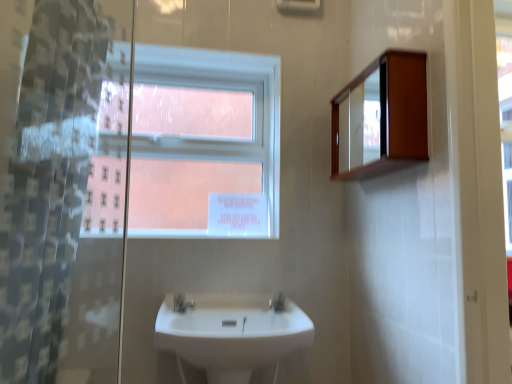
Question: Can you confirm if silver metallic tap at center, the second tap viewed from the right, is positioned to the right of white plastic window at upper center?

Choices:
 (A) no
 (B) yes

Answer: (B)

Question: Considering the relative sizes of silver metallic tap at center, which is counted as the first tap, starting from the left, and white plastic window at upper center in the image provided, is silver metallic tap at center, which is counted as the first tap, starting from the left, thinner than white plastic window at upper center?

Choices:
 (A) no
 (B) yes

Answer: (A)

Question: From a real-world perspective, is silver metallic tap at center, the second tap viewed from the right, beneath white plastic window at upper center?

Choices:
 (A) no
 (B) yes

Answer: (B)

Question: Can you confirm if silver metallic tap at center, which is counted as the first tap, starting from the left, is bigger than white plastic window at upper center?

Choices:
 (A) no
 (B) yes

Answer: (A)

Question: Does silver metallic tap at center, which is counted as the first tap, starting from the left, turn towards white plastic window at upper center?

Choices:
 (A) no
 (B) yes

Answer: (A)

Question: Is silver metallic tap at center, which is counted as the first tap, starting from the left, taller than white plastic window at upper center?

Choices:
 (A) no
 (B) yes

Answer: (A)

Question: From the image's perspective, is white glossy tap at center, the 1th tap viewed from the right, on wooden medicine cabinet at upper right?

Choices:
 (A) yes
 (B) no

Answer: (B)

Question: From the image's perspective, is white glossy tap at center, the 1th tap viewed from the right, located beneath wooden medicine cabinet at upper right?

Choices:
 (A) yes
 (B) no

Answer: (A)

Question: Does white glossy tap at center, the 1th tap viewed from the right, have a larger size compared to wooden medicine cabinet at upper right?

Choices:
 (A) yes
 (B) no

Answer: (B)

Question: Can you confirm if white glossy tap at center, the 1th tap viewed from the right, is thinner than wooden medicine cabinet at upper right?

Choices:
 (A) no
 (B) yes

Answer: (B)

Question: Can you confirm if white glossy tap at center, the 2th tap in the left-to-right sequence, is smaller than wooden medicine cabinet at upper right?

Choices:
 (A) yes
 (B) no

Answer: (A)

Question: Is white glossy tap at center, the 1th tap viewed from the right, surrounding wooden medicine cabinet at upper right?

Choices:
 (A) no
 (B) yes

Answer: (A)

Question: Considering the relative positions of silver metallic tap at center, which is counted as the first tap, starting from the left, and white glossy sink at center in the image provided, is silver metallic tap at center, which is counted as the first tap, starting from the left, to the left of white glossy sink at center from the viewer's perspective?

Choices:
 (A) yes
 (B) no

Answer: (A)